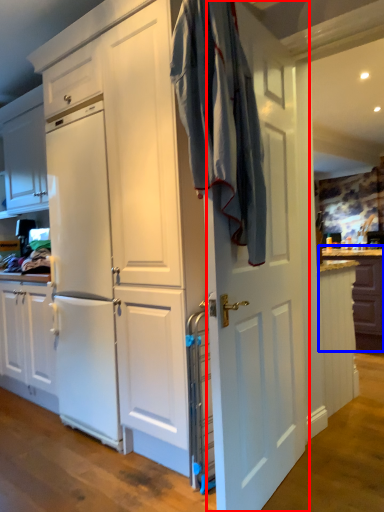
Question: Which object appears closest to the camera in this image, door (highlighted by a red box) or counter (highlighted by a blue box)?

Choices:
 (A) door
 (B) counter

Answer: (A)